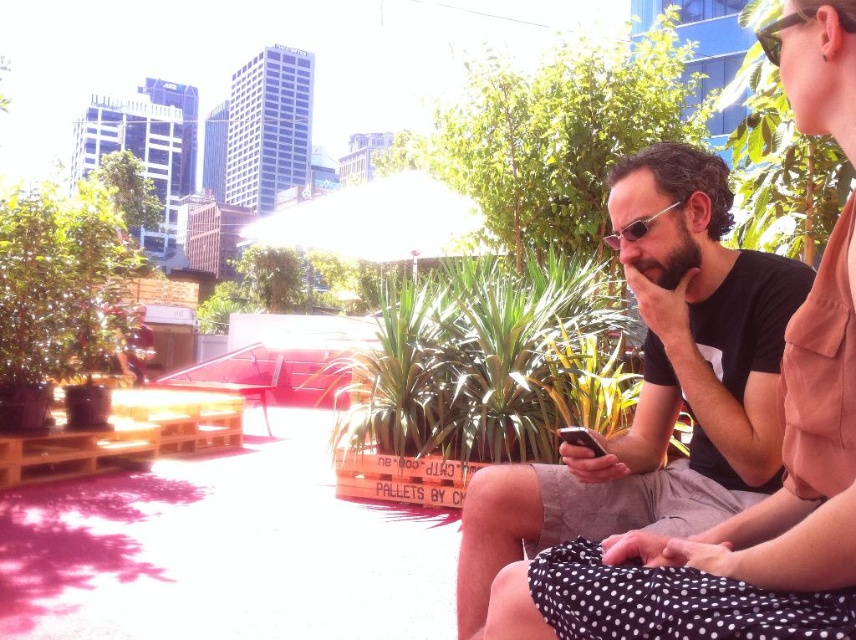
You are a photographer trying to capture a closeup shot of the black matte shirt at center and the sunglasses at center. Since the camera lens can only focus on one object at a time, which object should you focus on first to ensure the larger one is in focus?

The black matte shirt at center has a larger size compared to sunglasses at center, so you should focus on the black matte shirt at center first to ensure the larger object is in focus.

You are a photographer positioned in the scene and want to capture both the black matte shirt at center and the sunglasses at upper right in a single shot. However, you can only focus on one subject at a time. Which object should you focus on to ensure the other remains in the background?

You should focus on the black matte shirt at center because it is closer to you than the sunglasses at upper right, which will naturally appear in the background.

You are a photographer trying to capture a photo of both sunglasses at upper right and sunglasses at center. Since you want them in the same frame, which sunglasses should you position your camera closer to?

The sunglasses at upper right is on the right side of sunglasses at center, so to include both in the frame, position the camera closer to the sunglasses at center to ensure both are visible.